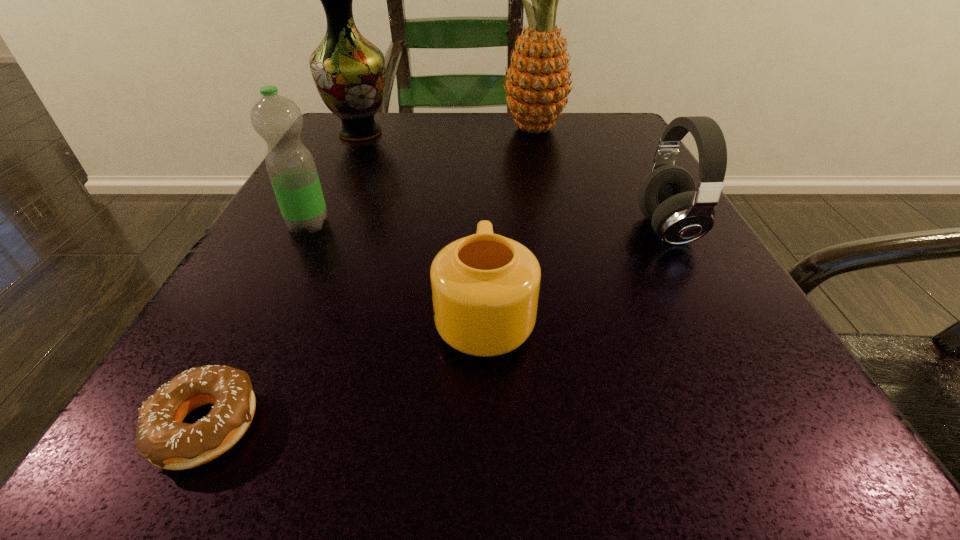
Image resolution: width=960 pixels, height=540 pixels. I want to click on pineapple, so click(537, 86).

At what (x,y) coordinates should I click in order to perform the action: click on the fifth shortest object. Please return your answer as a coordinate pair (x, y). Looking at the image, I should click on (349, 72).

Where is `water bottle`? Image resolution: width=960 pixels, height=540 pixels. water bottle is located at coordinates (278, 120).

Where is `the rightmost object`? The image size is (960, 540). the rightmost object is located at coordinates (680, 215).

At what (x,y) coordinates should I click in order to perform the action: click on the fourth tallest object. Please return your answer as a coordinate pair (x, y). Looking at the image, I should click on (680, 215).

You are a GUI agent. You are given a task and a screenshot of the screen. Output one action in this format:
    pyautogui.click(x=<x>, y=<y>)
    Task: Click on the second nearest object
    This screenshot has width=960, height=540.
    Given the screenshot: What is the action you would take?
    pyautogui.click(x=485, y=287)

At what (x,y) coordinates should I click in order to perform the action: click on mug. Please return your answer as a coordinate pair (x, y). This screenshot has height=540, width=960. Looking at the image, I should click on (485, 287).

Locate an element on the screen. Image resolution: width=960 pixels, height=540 pixels. the shortest object is located at coordinates (161, 437).

Locate an element on the screen. The height and width of the screenshot is (540, 960). doughnut is located at coordinates (161, 437).

At what (x,y) coordinates should I click in order to perform the action: click on vacant space located 0.290m on the left of the tallest object. Please return your answer as a coordinate pair (x, y). Looking at the image, I should click on (362, 129).